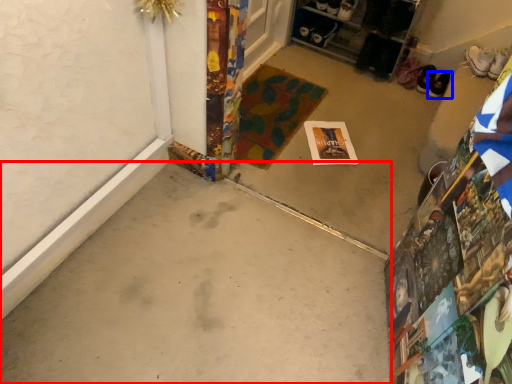
Question: Which of the following is the closest to the observer, concrete (highlighted by a red box) or footwear (highlighted by a blue box)?

Choices:
 (A) concrete
 (B) footwear

Answer: (A)